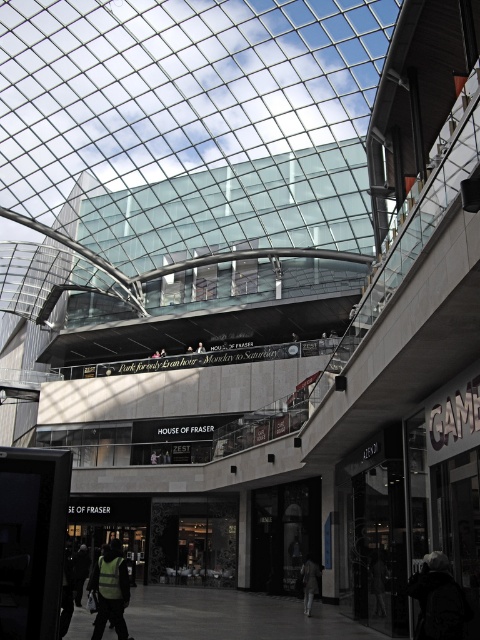
You are a store manager at HOUSE OF FRASER and need to display two jackets in your store window. The dark gray jacket at lower center and the green fabric jacket at center are your options. Which jacket should you choose to occupy more space in the display?

The dark gray jacket at lower center is larger in size than the green fabric jacket at center, so it should be chosen to occupy more space in the display.

You are a customer in the mall and you want to know which clothing item is shorter between the dark gray jacket at lower right and the reflective yellow vest at lower left. Can you tell me?

The dark gray jacket at lower right is not as tall as the reflective yellow vest at lower left, so the dark gray jacket at lower right is shorter.

You are standing at the entrance of the mall and see the dark gray jacket at lower right. If you want to reach it quickly, should you take the escalator or the stairs?

The dark gray jacket at lower right is 20.56 meters away from the viewer. Since escalators are typically faster for covering distances in malls, taking the escalator would be quicker to reach the dark gray jacket at lower right.